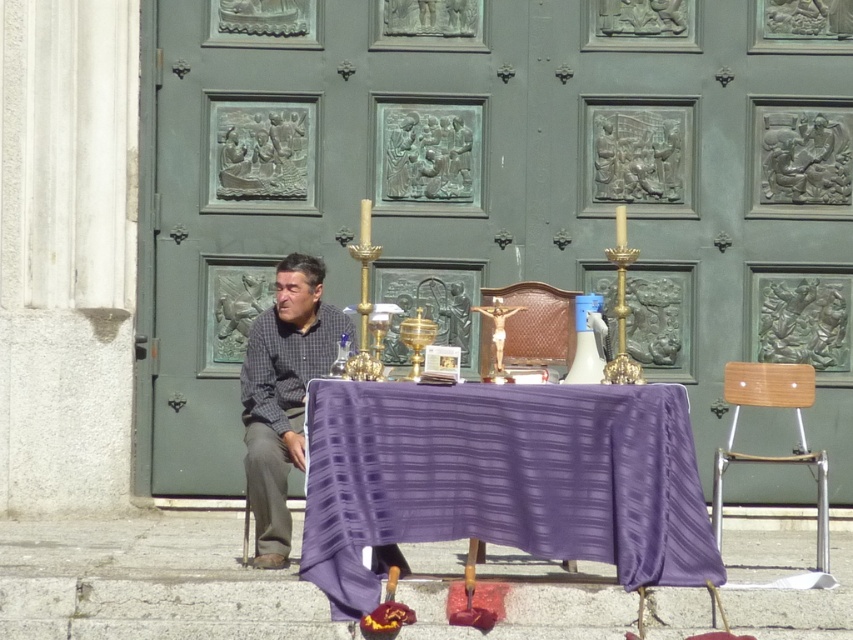
Question: Is purple fabric-covered table at center thinner than gray checkered shirt at left?

Choices:
 (A) no
 (B) yes

Answer: (A)

Question: Which of the following is the farthest from the observer?

Choices:
 (A) purple fabric-covered table at center
 (B) gray fabric chair at left
 (C) brown leather chair at center

Answer: (C)

Question: Observing the image, what is the correct spatial positioning of brown leather chair at center in reference to gray fabric chair at left?

Choices:
 (A) above
 (B) below

Answer: (A)

Question: Which object is the farthest from the gray fabric chair at left?

Choices:
 (A) brown leather chair at center
 (B) wooden at right
 (C) purple fabric-covered table at center

Answer: (B)

Question: Where is purple fabric-covered table at center located in relation to wooden at right in the image?

Choices:
 (A) below
 (B) above

Answer: (B)

Question: Which point appears farthest from the camera in this image?

Choices:
 (A) (387, 445)
 (B) (251, 376)
 (C) (561, 564)

Answer: (B)